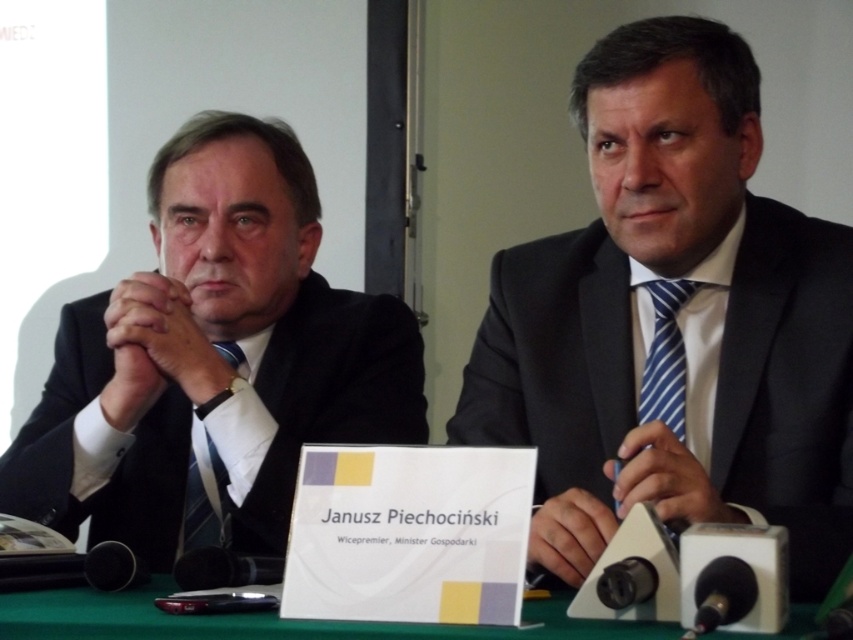
You are a photographer standing in front of the scene. You want to take a photo of the matte black suit at right and the green fabric table at center. Which object will appear larger in your photo?

The matte black suit at right appears larger in the photo because it is closer to the viewer than the green fabric table at center.

You are a photographer adjusting your camera to focus on two specific points in the image. The first point is at coordinates point (782, 493) and the second is at point (207, 616). Which point should you focus on first if you want to capture both points clearly in a single shot?

Point (782, 493) is further to the viewer than point (207, 616), so you should focus on point (782, 493) first to ensure both points are in focus.

You are standing at the point labeled as point (212, 241) in the image. You want to take a photo of the two men at the table using a camera that has a maximum focus range of 1.5 meters. Will the camera be able to focus on the two men?

The distance between point (212, 241) and the camera is 1.45 meters, which is within the camera maximum focus range of 1.5 meters. Therefore, the camera can focus on the two men.